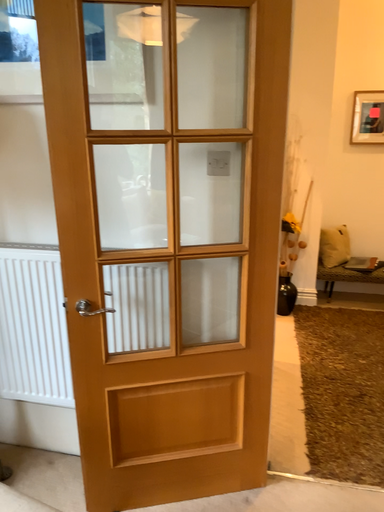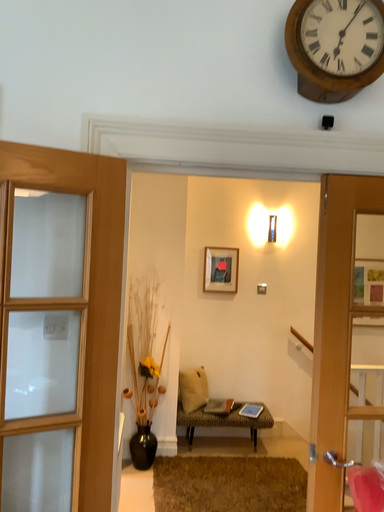
Question: How did the camera likely rotate when shooting the video?

Choices:
 (A) rotated left
 (B) rotated right

Answer: (B)